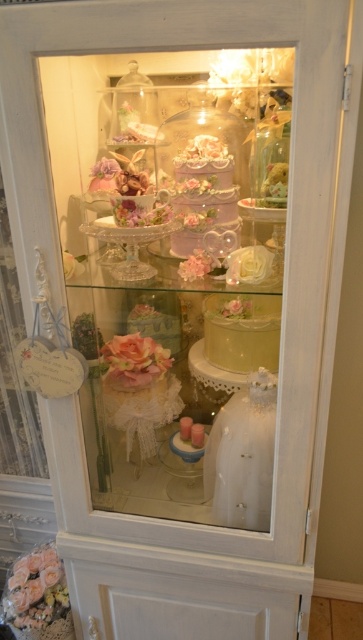
Which is in front, point (238, 218) or point (268, 353)?

Positioned in front is point (238, 218).

Can you confirm if pastel pink fondant cake at center is shorter than matte pink cake at center?

No.

Is point (222, 195) closer to viewer compared to point (241, 337)?

Yes, it is in front of point (241, 337).

Image resolution: width=363 pixels, height=640 pixels. What are the coordinates of `pastel pink fondant cake at center` in the screenshot? It's located at (202, 193).